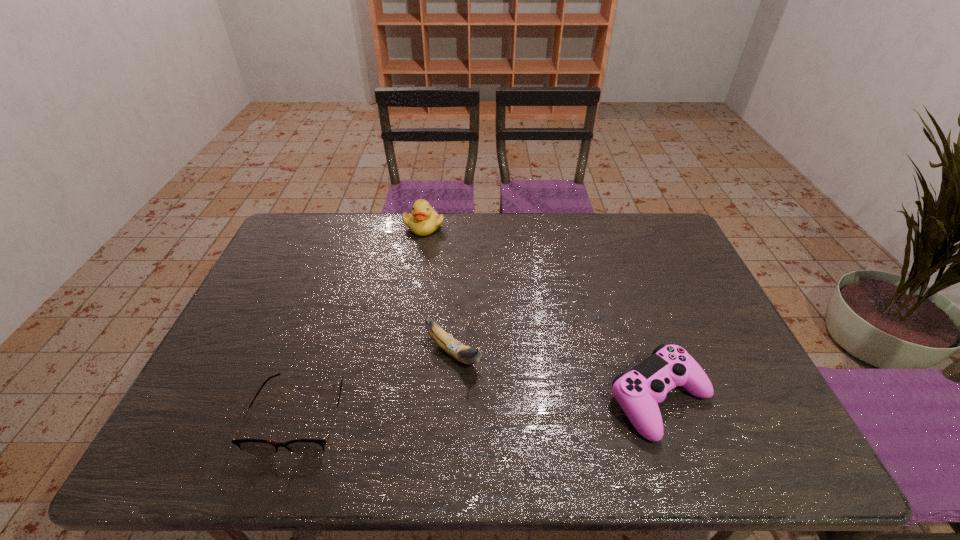
Identify the location of free space located on the front-facing side of the duckling. (448, 265).

Identify the location of vacant space located on the front-facing side of the duckling. The image size is (960, 540). (475, 309).

Find the location of a particular element. free location located 0.290m on the front-facing side of the duckling is located at coordinates (462, 288).

This screenshot has width=960, height=540. Identify the location of object that is at the far edge. click(x=424, y=220).

Where is `spectacles at the near edge`? The height and width of the screenshot is (540, 960). spectacles at the near edge is located at coordinates (256, 447).

This screenshot has width=960, height=540. I want to click on control that is positioned at the near edge, so click(637, 392).

Identify the location of object present at the right edge. (637, 392).

You are a GUI agent. You are given a task and a screenshot of the screen. Output one action in this format:
    pyautogui.click(x=<x>, y=<y>)
    Task: Click on the object at the near right corner
    The image size is (960, 540).
    Given the screenshot: What is the action you would take?
    pyautogui.click(x=637, y=392)

Identify the location of vacant space at the far edge of the desktop. This screenshot has height=540, width=960. (485, 249).

The width and height of the screenshot is (960, 540). Identify the location of vacant space at the near edge of the desktop. (294, 407).